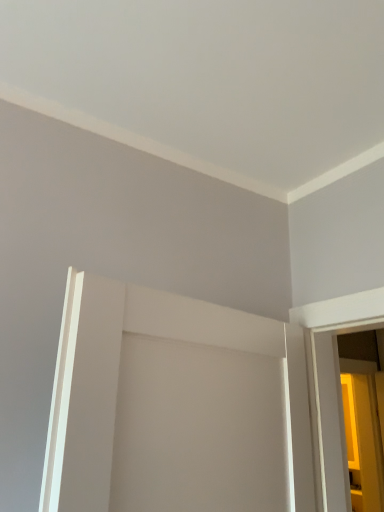
Question: Should I look upward or downward to see translucent glass screen door at right?

Choices:
 (A) down
 (B) up

Answer: (A)